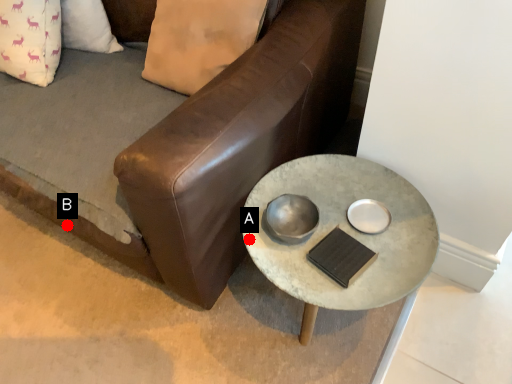
Question: Two points are circled on the image, labeled by A and B beside each circle. Among these points, which one is farthest from the camera?

Choices:
 (A) A is further
 (B) B is further

Answer: (B)